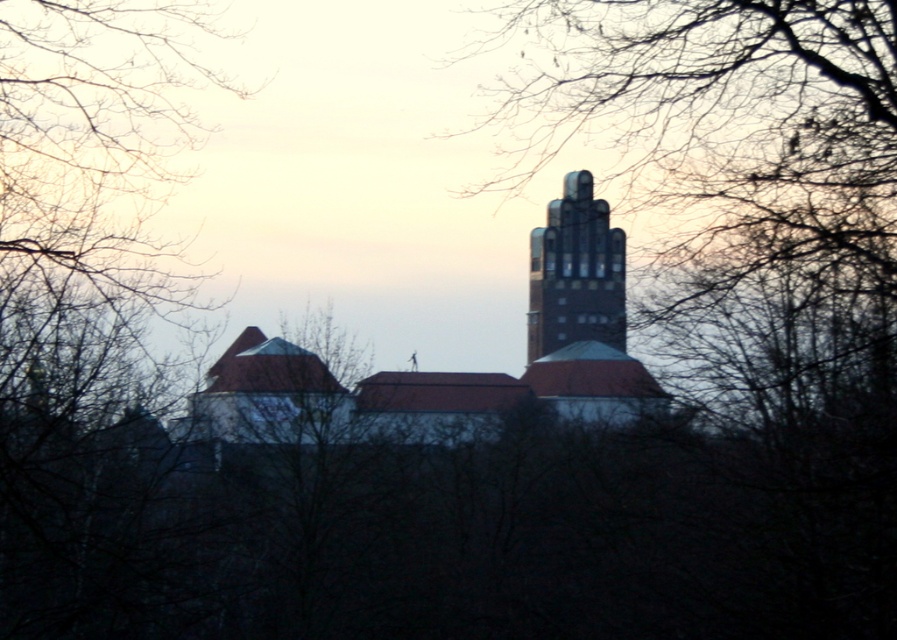
You are an architect analyzing the structures in this scene. Given that the brown textured church at center and the dark brick tower at center are both central landmarks, which one would you estimate to be taller based on their positions in the image?

The brown textured church at center is taller than the dark brick tower at center according to the description provided.

You are standing in the foreground of the scene, looking towards the buildings. You need to walk to the brown textured church at center and the dark brick tower at center. Which one will you reach first?

The brown textured church at center is 3.90 feet away from the dark brick tower at center. Since you are standing in the foreground, the church and tower are both in the midground, so you would reach them at the same time as they are part of the same midground area. However, based on the description, the church is closer to the tower, but without knowing your exact starting point, it is impossible to determine which is closer to you.

You are an architect analyzing the spatial arrangement of the buildings in the image. Given that the brown textured church at center and the dark brick tower at center are both central elements, how does their positioning affect the visual hierarchy of the composition?

The brown textured church at center is positioned under the dark brick tower at center, making the tower appear dominant and drawing the viewer eye upward, while the church serves as a supporting element below, creating a layered visual hierarchy.